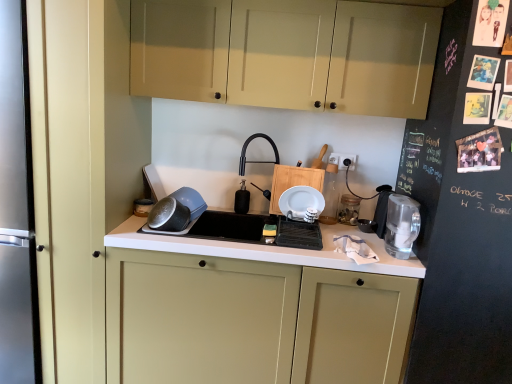
Locate an element on the screen. free space in front of matte black kettle at right, which appears as the 1th appliance when viewed from the right is located at coordinates (372, 241).